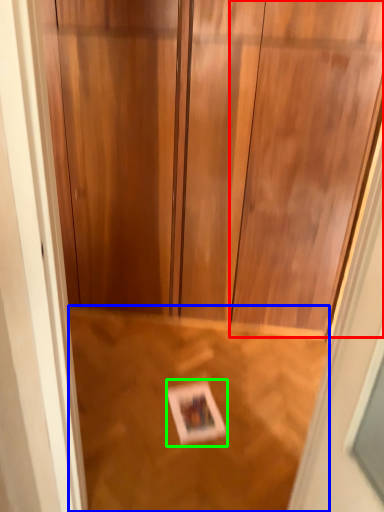
Question: Which object is the closest to the door (highlighted by a red box)? Choose among these: plywood (highlighted by a blue box) or postcard (highlighted by a green box).

Choices:
 (A) plywood
 (B) postcard

Answer: (A)